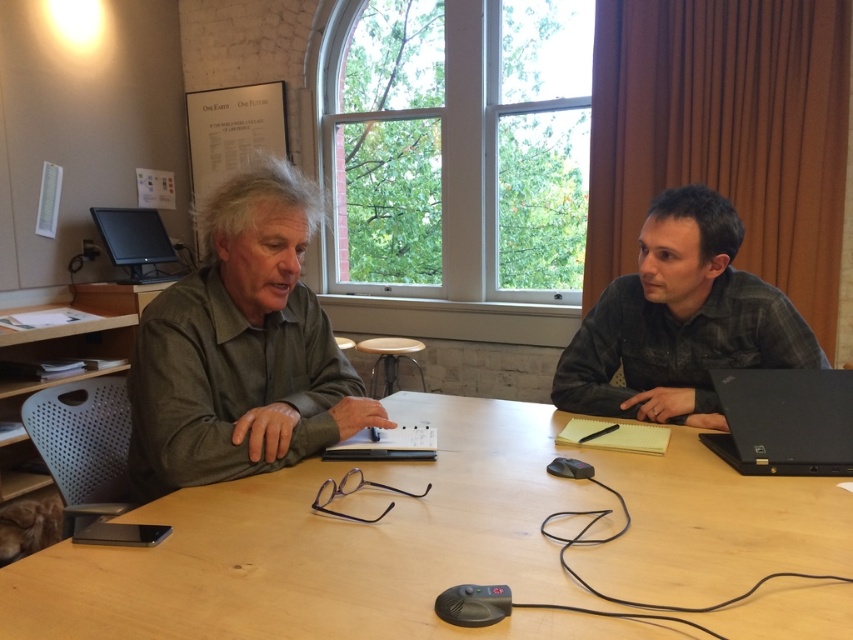
Does green matte shirt at left have a lesser height compared to plaid shirt at right?

No.

Who is higher up, green matte shirt at left or plaid shirt at right?

plaid shirt at right is above.

Describe the element at coordinates (241, 348) in the screenshot. I see `green matte shirt at left` at that location.

I want to click on green matte shirt at left, so click(241, 348).

Is point (144, 278) positioned behind point (393, 369)?

No, (144, 278) is in front of (393, 369).

Is matte black monitor at upper left smaller than wooden table at center?

No, matte black monitor at upper left is not smaller than wooden table at center.

Between point (161, 259) and point (418, 346), which one is positioned behind?

The point (161, 259) is more distant.

At what (x,y) coordinates should I click in order to perform the action: click on matte black monitor at upper left. Please return your answer as a coordinate pair (x, y). The width and height of the screenshot is (853, 640). Looking at the image, I should click on (134, 241).

Is light brown wood table at center positioned behind wooden table at center?

No, light brown wood table at center is in front of wooden table at center.

Who is shorter, light brown wood table at center or wooden table at center?

With less height is light brown wood table at center.

At what (x,y) coordinates should I click in order to perform the action: click on light brown wood table at center. Please return your answer as a coordinate pair (x, y). Looking at the image, I should click on (437, 541).